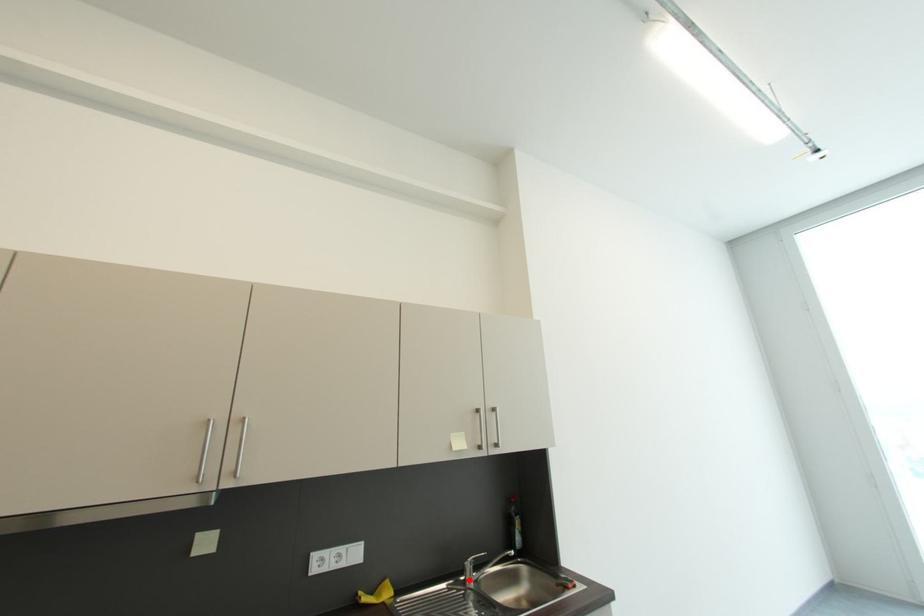
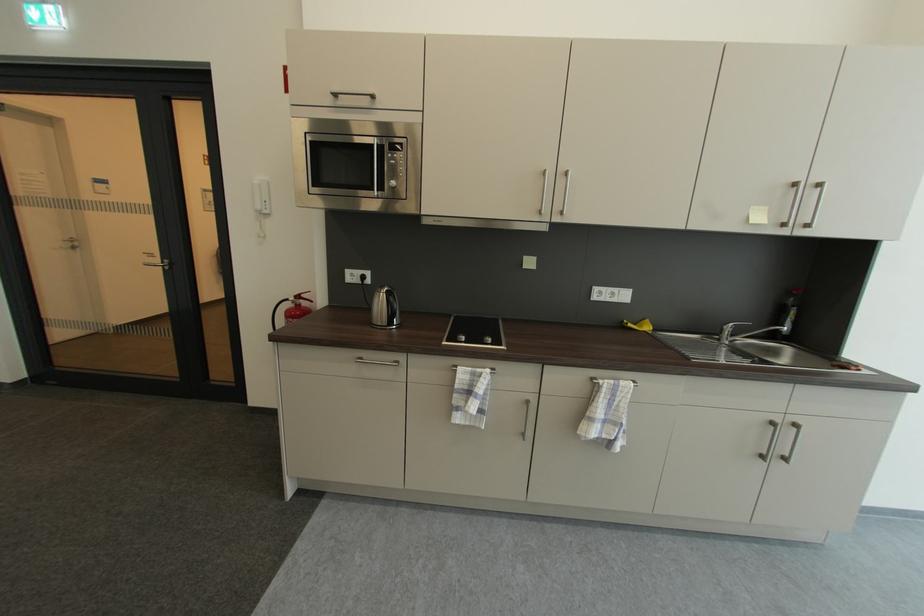
Find the pixel in the second image that matches the highlighted location in the first image.

(723, 339)